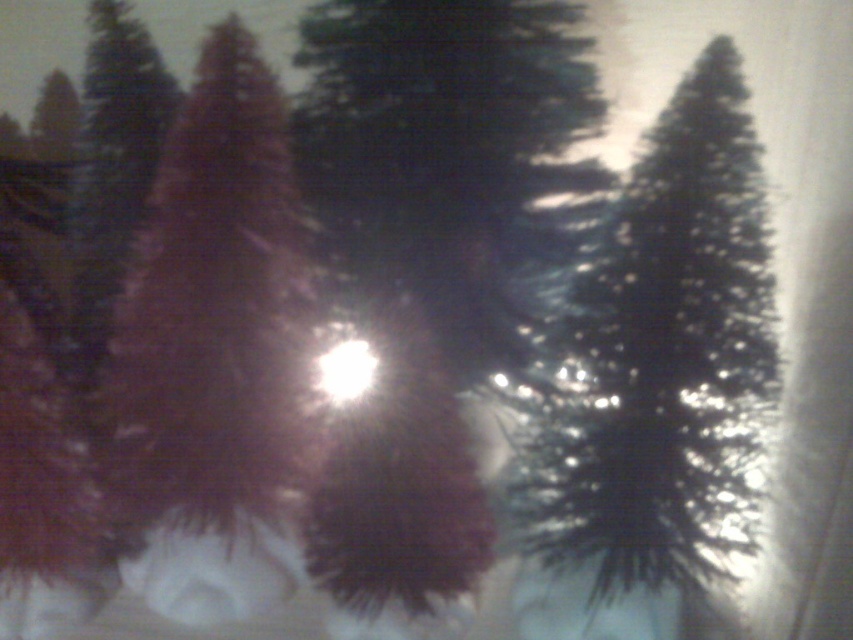
You are an observer in the snowy forest scene. You notice two red fir trees, the shiny red fir tree at left and the matte red fir tree at center. Which one is positioned lower in the image?

The shiny red fir tree at left is positioned lower than the matte red fir tree at center.

You are standing in the snowy forest scene and want to reach the bright light source at the center. There is a point marked at coordinates point (x=570, y=298) that is 34.05 inches away from you. Can you estimate how far you need to walk to reach the bright light source?

The point marked at coordinates point (x=570, y=298) is 34.05 inches away from you, so you need to walk approximately 34.05 inches to reach the bright light source at the center.

You are a photographer trying to capture the sun in the center of your photo. There is a shiny red fir tree at left in the way. Where should you move your camera to avoid the tree while still keeping the sun in the center?

Since the shiny red fir tree at left is located at point [213,310], you should move your camera to the right and slightly upwards to keep the sun centered while avoiding the tree.